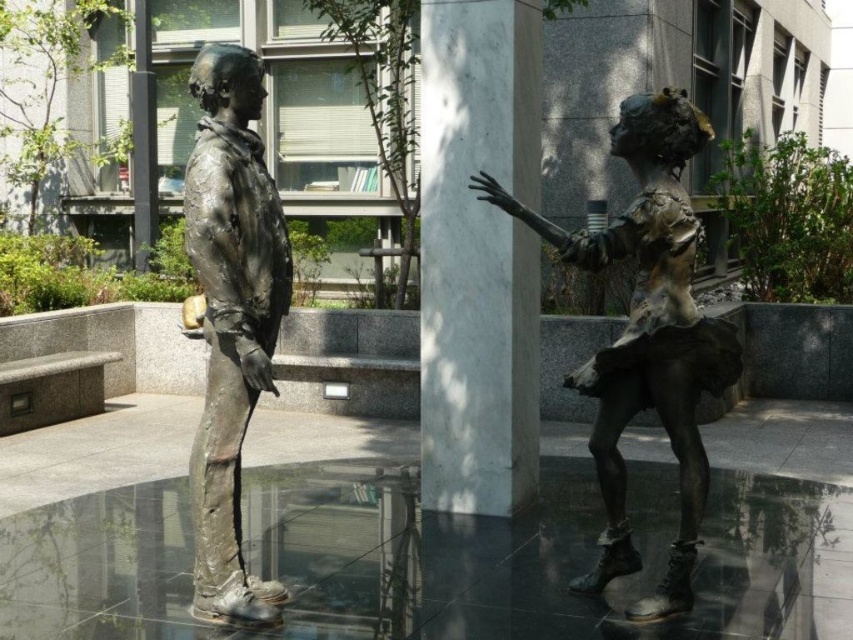
You are standing in the plaza and want to take a photo of the two bronze statues. To ensure the white marble pillar at center is not blocking your view, where should you position yourself relative to the statues?

To avoid the white marble pillar at center blocking your view, you should position yourself to the left or right side of the statues, as the pillar is centrally located between them.

You are an art curator planning to move both the bronze textured ballerina at center and the bronze statue at center to a new gallery. The gallery has a 1.5 meter wide entrance. Which statue should be moved first to ensure the widest one fits through the entrance?

The bronze textured ballerina at center should be moved first because its width surpasses that of the bronze statue at center, ensuring the wider statue is moved first to accommodate the entrance width.

What object is located at the coordinates point (646, 333)?

The bronze textured ballerina at center is located at point (646, 333).